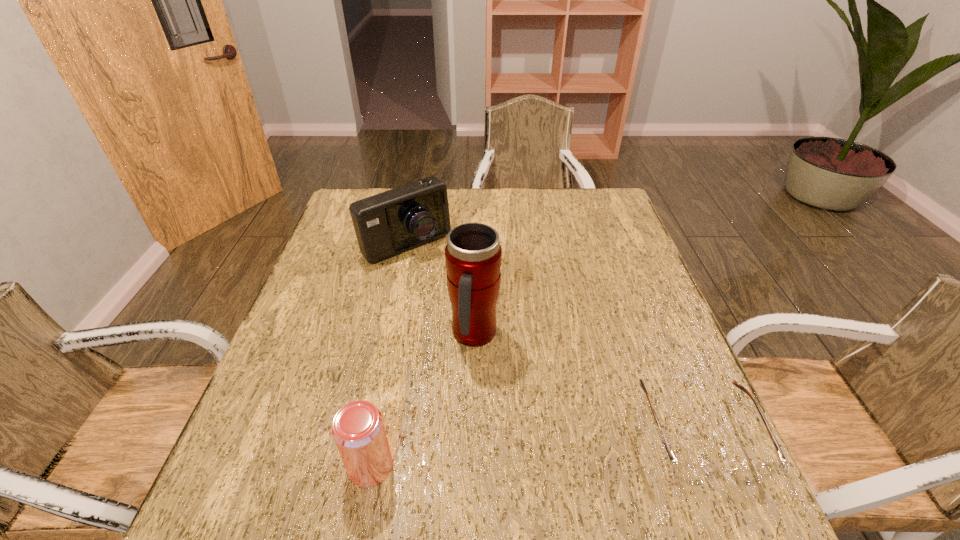
The height and width of the screenshot is (540, 960). I want to click on vacant area between the second object from right to left and the third shortest object, so click(x=441, y=291).

Locate an element on the screen. The height and width of the screenshot is (540, 960). blank region between the rightmost object and the third tallest object is located at coordinates (536, 450).

Image resolution: width=960 pixels, height=540 pixels. I want to click on unoccupied area between the farthest object and the third tallest object, so click(389, 355).

At what (x,y) coordinates should I click in order to perform the action: click on empty location between the third nearest object and the spectacles. Please return your answer as a coordinate pair (x, y). The image size is (960, 540). Looking at the image, I should click on (588, 384).

At what (x,y) coordinates should I click in order to perform the action: click on blank region between the rightmost object and the tallest object. Please return your answer as a coordinate pair (x, y). Looking at the image, I should click on (588, 384).

Locate an element on the screen. The height and width of the screenshot is (540, 960). object that is the closest to the second tallest object is located at coordinates (473, 256).

Select which object is the second closest to the camera. Please provide its 2D coordinates. Your answer should be formatted as a tuple, i.e. [(x, y)], where the tuple contains the x and y coordinates of a point satisfying the conditions above.

[(358, 430)]